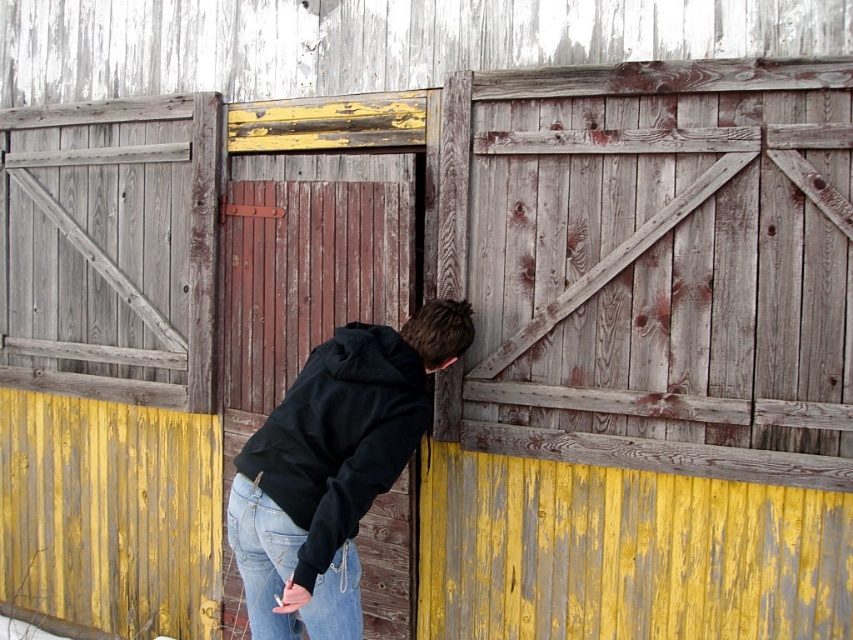
Is weathered wood door at center below jeans at lower center?

No.

The height and width of the screenshot is (640, 853). What do you see at coordinates (668, 266) in the screenshot?
I see `weathered wood door at center` at bounding box center [668, 266].

Is point (722, 200) positioned before point (260, 516)?

No, it is not.

You are a GUI agent. You are given a task and a screenshot of the screen. Output one action in this format:
    pyautogui.click(x=<x>, y=<y>)
    Task: Click on the weathered wood door at center
    
    Given the screenshot: What is the action you would take?
    pyautogui.click(x=668, y=266)

In the scene shown: Who is more forward, (x=729, y=273) or (x=399, y=346)?

Positioned in front is point (x=399, y=346).

Is weathered wood door at center bigger than black fleece sweatshirt at center?

Indeed, weathered wood door at center has a larger size compared to black fleece sweatshirt at center.

This screenshot has height=640, width=853. What are the coordinates of `weathered wood door at center` in the screenshot? It's located at (668, 266).

Image resolution: width=853 pixels, height=640 pixels. I want to click on weathered wood door at center, so click(x=668, y=266).

Can you confirm if black fleece sweatshirt at center is taller than jeans at lower center?

Yes.

Is black fleece sweatshirt at center positioned at the back of jeans at lower center?

No, it is in front of jeans at lower center.

Measure the distance between black fleece sweatshirt at center and camera.

They are 9.54 feet apart.

Find the location of `black fleece sweatshirt at center`. black fleece sweatshirt at center is located at coordinates (339, 436).